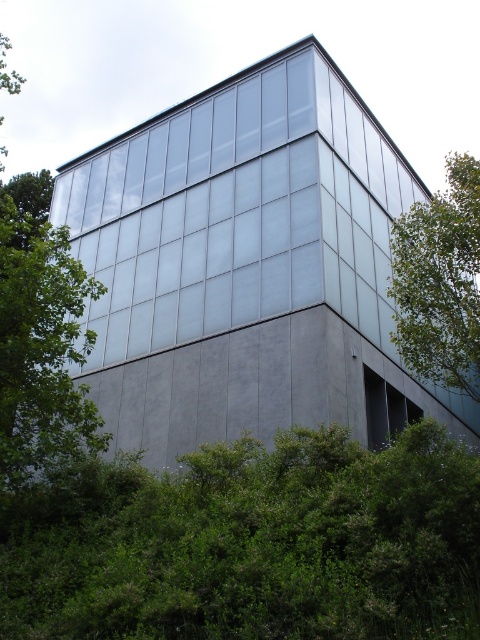
The height and width of the screenshot is (640, 480). Identify the location of green leafy bush at lower center. (251, 544).

Which is behind, point (276, 552) or point (384, 413)?

Positioned behind is point (384, 413).

The width and height of the screenshot is (480, 640). Identify the location of green leafy bush at lower center. (251, 544).

The image size is (480, 640). In order to click on green leafy bush at lower center in this screenshot , I will do `click(251, 544)`.

Between green leafy bush at lower center and green leafy tree at left, which one appears on the right side from the viewer's perspective?

green leafy bush at lower center

Is point (218, 568) behind point (10, 88)?

No.

Locate an element on the screen. The width and height of the screenshot is (480, 640). green leafy bush at lower center is located at coordinates (251, 544).

Which of these two, green leafy tree at left or transparent glass window at center, stands shorter?

transparent glass window at center

Is green leafy tree at left smaller than transparent glass window at center?

Actually, green leafy tree at left might be larger than transparent glass window at center.

Which is behind, point (14, 396) or point (400, 396)?

Positioned behind is point (400, 396).

At what (x,y) coordinates should I click in order to perform the action: click on green leafy tree at left. Please return your answer as a coordinate pair (x, y). Looking at the image, I should click on (40, 337).